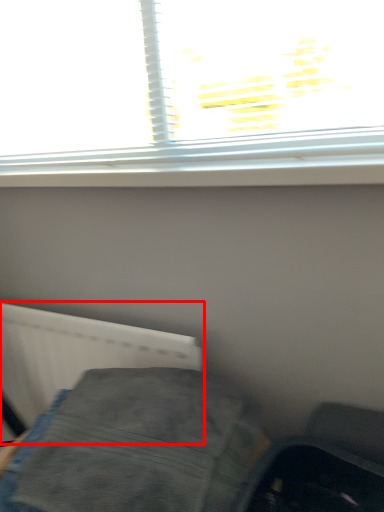
Question: Where is radiator (annotated by the red box) located in relation to furniture in the image?

Choices:
 (A) left
 (B) right

Answer: (A)